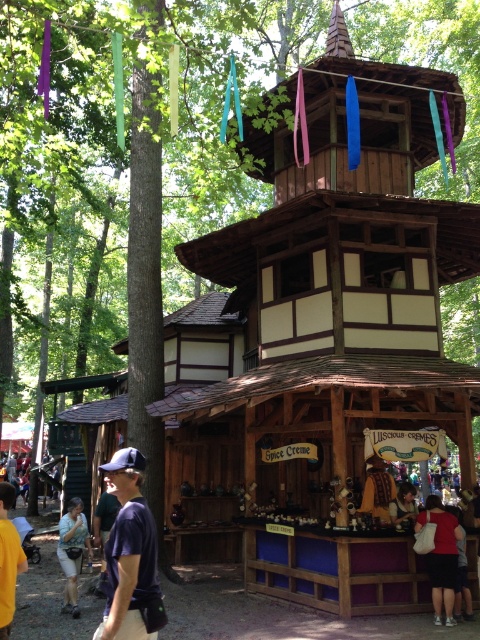
Question: Estimate the real-world distances between objects in this image. Which object is farther from the light blue denim shorts at lower left?

Choices:
 (A) dark blue t-shirt at lower left
 (B) smooth brown leather purse at lower right
 (C) dark blue fabric cap at lower left
 (D) matte red shirt at lower right

Answer: (C)

Question: Does dark blue t-shirt at lower left have a smaller size compared to smooth brown leather purse at lower right?

Choices:
 (A) no
 (B) yes

Answer: (A)

Question: Considering the real-world distances, which object is farthest from the light blue denim shorts at lower left?

Choices:
 (A) smooth brown leather purse at lower right
 (B) matte red shirt at lower right
 (C) dark blue fabric cap at lower left

Answer: (C)

Question: Does matte red shirt at lower right have a larger size compared to light blue denim shorts at lower left?

Choices:
 (A) yes
 (B) no

Answer: (B)

Question: Can you confirm if dark blue fabric cap at lower left is wider than smooth brown leather purse at lower right?

Choices:
 (A) yes
 (B) no

Answer: (A)

Question: Which object appears farthest from the camera in this image?

Choices:
 (A) smooth brown leather purse at lower right
 (B) dark blue t-shirt at lower left
 (C) dark blue fabric cap at lower left
 (D) light blue denim shorts at lower left

Answer: (A)